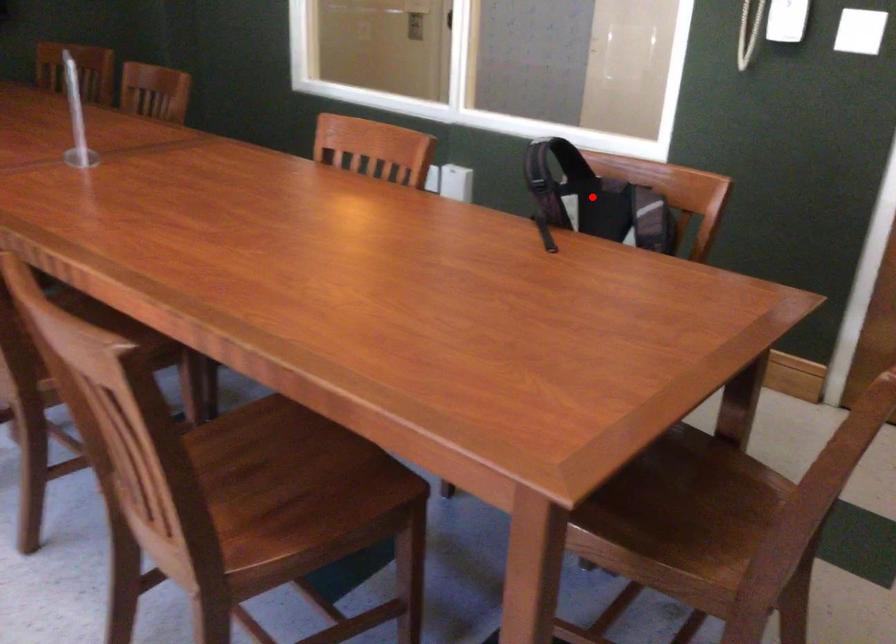
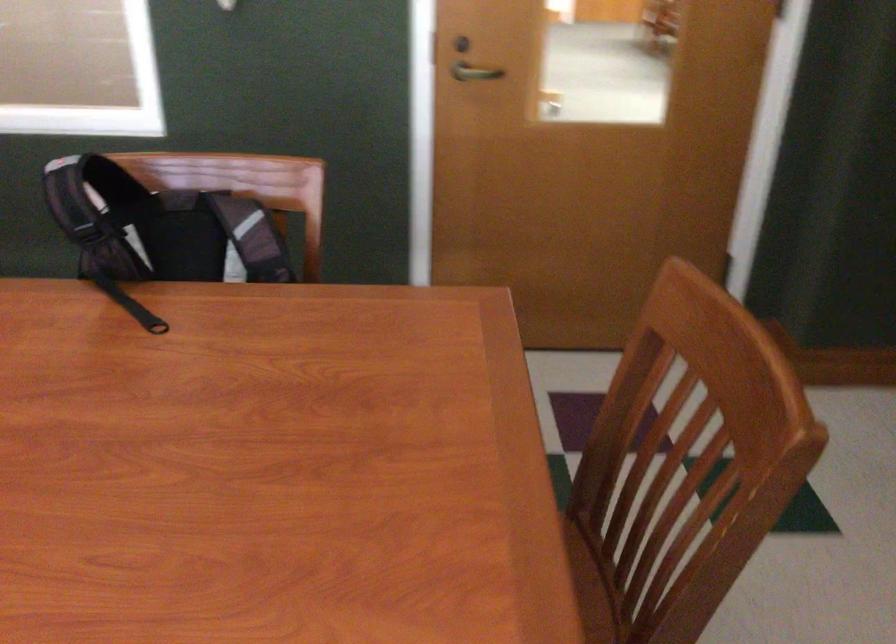
Question: I am providing you with two images of the same scene from different viewpoints. Given a red point in image1, look at the same physical point in image2. Is it:

Choices:
 (A) Closer to the viewpoint
 (B) Farther from the viewpoint

Answer: (A)